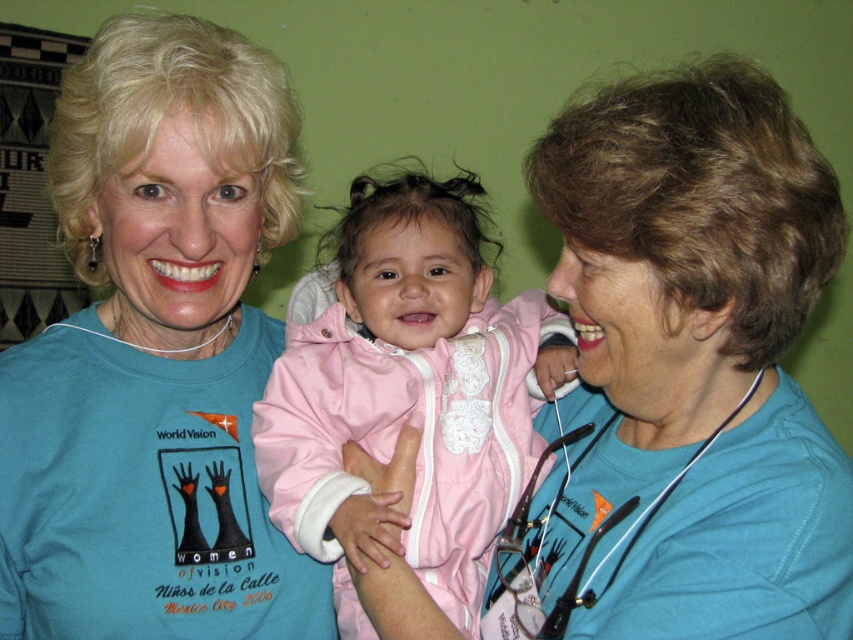
Question: Among these points, which one is nearest to the camera?

Choices:
 (A) (405, 394)
 (B) (590, 573)
 (C) (112, 179)

Answer: (B)

Question: Estimate the real-world distances between objects in this image. Which object is farther from the white plastic stethoscope at lower right?

Choices:
 (A) matte blue shirt at center
 (B) pink satin jacket at center

Answer: (A)

Question: Does pink satin jacket at center appear on the left side of white plastic stethoscope at lower right?

Choices:
 (A) yes
 (B) no

Answer: (A)

Question: Which object appears closest to the camera in this image?

Choices:
 (A) pink satin jacket at center
 (B) white plastic stethoscope at lower right
 (C) matte blue shirt at center

Answer: (B)

Question: Where is matte blue shirt at center located in relation to pink satin jacket at center in the image?

Choices:
 (A) left
 (B) right

Answer: (A)

Question: Is matte blue shirt at center further to camera compared to pink satin jacket at center?

Choices:
 (A) yes
 (B) no

Answer: (B)